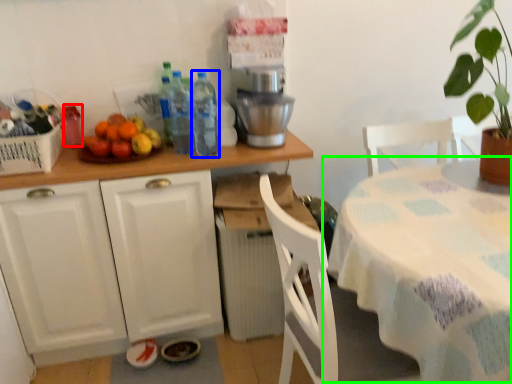
Question: Which object is the farthest from bottle (highlighted by a red box)? Choose among these: bottle (highlighted by a blue box) or table (highlighted by a green box).

Choices:
 (A) bottle
 (B) table

Answer: (B)